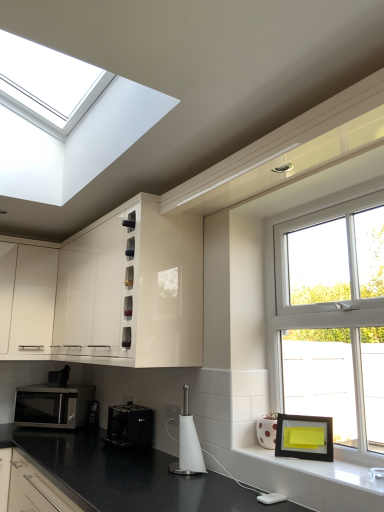
Question: Considering the relative positions of white paper towel holder at center, which appears as the 1th appliance when viewed from the right, and white glossy electric outlet at center, placed as the second electric outlet when sorted from bottom to top, in the image provided, is white paper towel holder at center, which appears as the 1th appliance when viewed from the right, to the left or to the right of white glossy electric outlet at center, placed as the second electric outlet when sorted from bottom to top,?

Choices:
 (A) right
 (B) left

Answer: (A)

Question: In the image, is white paper towel holder at center, arranged as the third appliance when viewed from the back, positioned in front of or behind white glossy electric outlet at center, arranged as the 2th electric outlet when viewed from the back?

Choices:
 (A) behind
 (B) front

Answer: (B)

Question: Based on their relative distances, which object is nearer to the black plastic toaster at lower center, acting as the second appliance starting from the left?

Choices:
 (A) white glossy window sill at lower right
 (B) white glossy cabinet at left, positioned as the first cabinetry in left-to-right order
 (C) white glossy electric outlet at center, arranged as the 2th electric outlet when viewed from the back
 (D) white glossy electric outlet at lower center, positioned as the 1th electric outlet in back-to-front order
 (E) glossy white cabinet at upper center, which is the first cabinetry in right-to-left order

Answer: (D)

Question: Which object is positioned closest to the white glossy window sill at lower right?

Choices:
 (A) silver metallic microwave at lower left
 (B) black plastic toaster at lower center, acting as the second appliance starting from the right
 (C) white glossy electric outlet at lower center, the 1th electric outlet viewed from the left
 (D) white glossy electric outlet at center, placed as the 1th electric outlet when sorted from top to bottom
 (E) white glossy cabinet at left, positioned as the first cabinetry in left-to-right order

Answer: (D)